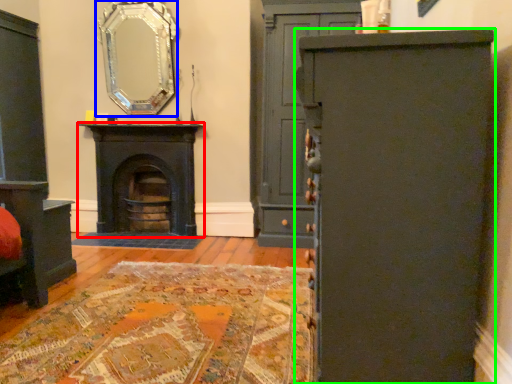
Question: Considering the real-world distances, which object is closest to fireplace (highlighted by a red box)? mirror (highlighted by a blue box) or cabinetry (highlighted by a green box).

Choices:
 (A) mirror
 (B) cabinetry

Answer: (A)